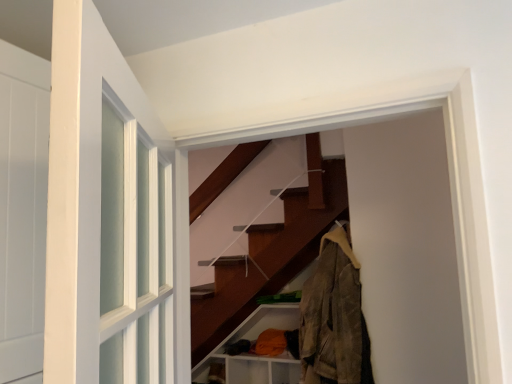
Question: Are orange fabric at lower right and camouflage fabric jacket at right beside each other?

Choices:
 (A) no
 (B) yes

Answer: (A)

Question: Can you confirm if orange fabric at lower right is wider than camouflage fabric jacket at right?

Choices:
 (A) no
 (B) yes

Answer: (B)

Question: Is orange fabric at lower right further to the viewer compared to camouflage fabric jacket at right?

Choices:
 (A) yes
 (B) no

Answer: (A)

Question: Is camouflage fabric jacket at right at the back of orange fabric at lower right?

Choices:
 (A) no
 (B) yes

Answer: (A)

Question: Is orange fabric at lower right to the right of camouflage fabric jacket at right from the viewer's perspective?

Choices:
 (A) yes
 (B) no

Answer: (B)

Question: Based on their positions, is orange fabric at lower right located to the left or right of brown matte shelf at lower center?

Choices:
 (A) right
 (B) left

Answer: (A)

Question: From a real-world perspective, is orange fabric at lower right above or below brown matte shelf at lower center?

Choices:
 (A) below
 (B) above

Answer: (B)

Question: From their relative heights in the image, would you say orange fabric at lower right is taller or shorter than brown matte shelf at lower center?

Choices:
 (A) tall
 (B) short

Answer: (A)

Question: Considering the positions of orange fabric at lower right and brown matte shelf at lower center in the image, is orange fabric at lower right wider or thinner than brown matte shelf at lower center?

Choices:
 (A) thin
 (B) wide

Answer: (B)

Question: Would you say orange fabric at lower right is inside or outside camouflage fabric jacket at right?

Choices:
 (A) inside
 (B) outside

Answer: (B)

Question: Is point (242, 372) closer or farther from the camera than point (355, 269)?

Choices:
 (A) farther
 (B) closer

Answer: (A)

Question: From their relative heights in the image, would you say orange fabric at lower right is taller or shorter than camouflage fabric jacket at right?

Choices:
 (A) short
 (B) tall

Answer: (A)

Question: From the image's perspective, is orange fabric at lower right above or below camouflage fabric jacket at right?

Choices:
 (A) below
 (B) above

Answer: (A)

Question: From the image's perspective, is brown matte shelf at lower center above or below orange fabric at lower right?

Choices:
 (A) above
 (B) below

Answer: (B)

Question: Which is correct: brown matte shelf at lower center is inside orange fabric at lower right, or outside of it?

Choices:
 (A) outside
 (B) inside

Answer: (B)